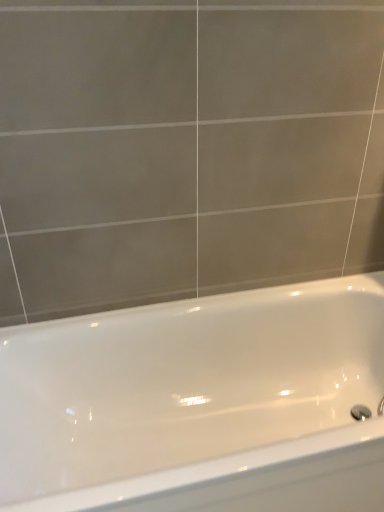
What do you see at coordinates (200, 404) in the screenshot? This screenshot has height=512, width=384. I see `white glossy bathtub at lower center` at bounding box center [200, 404].

Where is `white glossy bathtub at lower center`? The image size is (384, 512). white glossy bathtub at lower center is located at coordinates (200, 404).

Image resolution: width=384 pixels, height=512 pixels. I want to click on white glossy bathtub at lower center, so click(x=200, y=404).